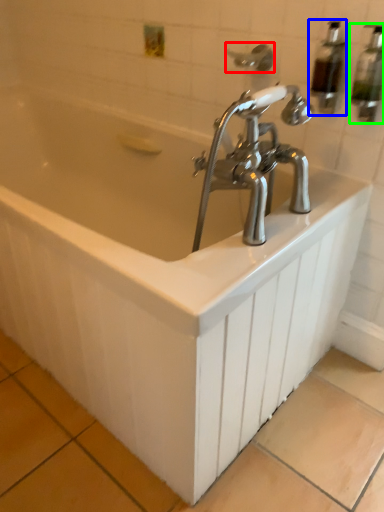
Question: Based on their relative distances, which object is nearer to shower (highlighted by a red box)? Choose from soap dispenser (highlighted by a blue box) and soap dispenser (highlighted by a green box).

Choices:
 (A) soap dispenser
 (B) soap dispenser

Answer: (A)